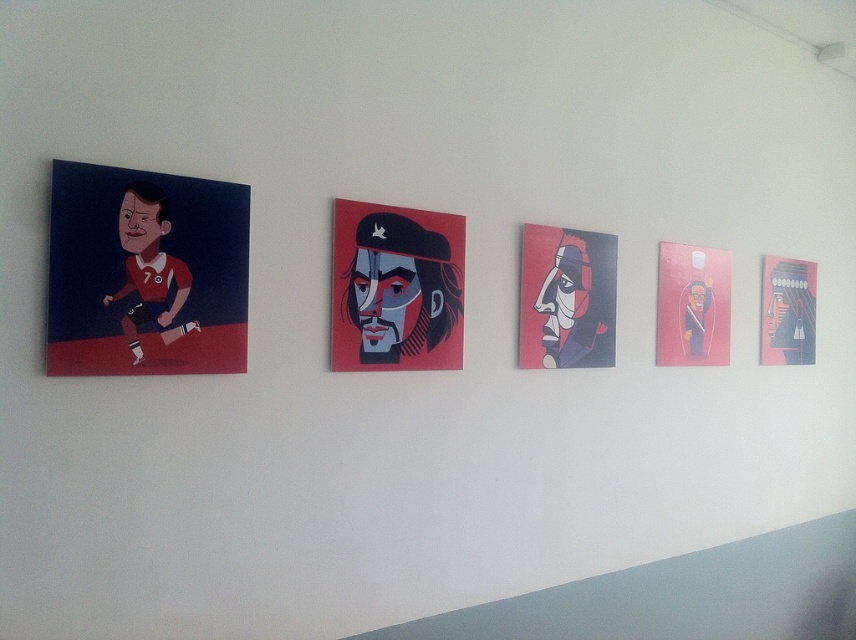
You are standing in front of the wall with five artworks. You see two points labeled as point 1 at coordinates point (580, 243) and point 2 at coordinates point (792, 300). Which point is closer to you?

Point (580, 243) is in front of point (792, 300), so it is closer to you.